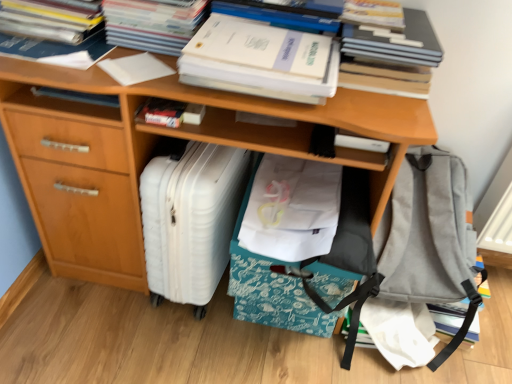
Find the location of a particular element. white matte book at center, the 3th book viewed from the right is located at coordinates (194, 114).

Describe the element at coordinates (428, 239) in the screenshot. The height and width of the screenshot is (384, 512). I see `gray fabric backpack at lower right` at that location.

What do you see at coordinates (57, 50) in the screenshot?
I see `white paper at upper left, which is counted as the first book, starting from the left` at bounding box center [57, 50].

Where is `white matte book at center, the 3th book viewed from the right`? white matte book at center, the 3th book viewed from the right is located at coordinates (194, 114).

Based on the photo, considering the sizes of white paper at upper left, which is counted as the first book, starting from the left, and white matte book at center, the 3th book viewed from the right, in the image, is white paper at upper left, which is counted as the first book, starting from the left, bigger or smaller than white matte book at center, the 3th book viewed from the right,?

Considering their sizes, white paper at upper left, which is counted as the first book, starting from the left, takes up more space than white matte book at center, the 3th book viewed from the right.

From the image's perspective, who appears lower, white paper at upper left, which appears as the sixth book when viewed from the right, or white matte book at center, the 3th book viewed from the right?

white matte book at center, the 3th book viewed from the right, appears lower in the image.

From a real-world perspective, who is located higher, white paper at upper left, which appears as the sixth book when viewed from the right, or white matte book at center, the 3th book viewed from the right?

white paper at upper left, which appears as the sixth book when viewed from the right.

From the image's perspective, which is below, hardcover book at center, positioned as the 3th paperback book in right-to-left order, or white plastic suitcase at lower left?

From the image's view, white plastic suitcase at lower left is below.

Looking at this image, from a real-world perspective, between hardcover book at center, positioned as the 3th paperback book in right-to-left order, and white plastic suitcase at lower left, who is vertically higher?

hardcover book at center, positioned as the 3th paperback book in right-to-left order, from a real-world perspective.

Between hardcover book at center, positioned as the 3th paperback book in right-to-left order, and white plastic suitcase at lower left, which one appears on the left side from the viewer's perspective?

From the viewer's perspective, hardcover book at center, positioned as the 3th paperback book in right-to-left order, appears more on the left side.

Is hardcover book at center, positioned as the 3th paperback book in right-to-left order, far from white plastic suitcase at lower left?

Actually, hardcover book at center, positioned as the 3th paperback book in right-to-left order, and white plastic suitcase at lower left are a little close together.

From a real-world perspective, is white paper at upper left, which is counted as the second book, starting from the left, physically above white paper at upper center, the second paperback book viewed from the left?

Incorrect, from a real-world perspective, white paper at upper left, which is counted as the second book, starting from the left, is lower than white paper at upper center, the second paperback book viewed from the left.

Is the surface of white paper at upper left, which is counted as the second book, starting from the left, in direct contact with white paper at upper center, the second paperback book viewed from the left?

No, white paper at upper left, which is counted as the second book, starting from the left, is not next to white paper at upper center, the second paperback book viewed from the left.

Which of these two, white paper at upper left, which is counted as the second book, starting from the left, or white paper at upper center, the second paperback book viewed from the left, stands shorter?

white paper at upper left, which is counted as the second book, starting from the left, is shorter.

Does point (72, 34) come behind point (108, 0)?

Yes, point (72, 34) is behind point (108, 0).

Is white paper at upper left, which is counted as the first book, starting from the left, not close to gray fabric backpack at lower right?

Yes, white paper at upper left, which is counted as the first book, starting from the left, and gray fabric backpack at lower right are quite far apart.

From a real-world perspective, which is physically above, white paper at upper left, which is counted as the first book, starting from the left, or gray fabric backpack at lower right?

From a 3D spatial view, white paper at upper left, which is counted as the first book, starting from the left, is above.

Is white paper at upper left, which appears as the sixth book when viewed from the right, positioned before gray fabric backpack at lower right?

Yes, white paper at upper left, which appears as the sixth book when viewed from the right, is closer to the viewer.

Considering the sizes of white paper at upper left, which is counted as the first book, starting from the left, and gray fabric backpack at lower right in the image, is white paper at upper left, which is counted as the first book, starting from the left, wider or thinner than gray fabric backpack at lower right?

Considering their sizes, white paper at upper left, which is counted as the first book, starting from the left, looks slimmer than gray fabric backpack at lower right.

The image size is (512, 384). I want to click on luggage that appears below the white fabric at center (from a real-world perspective), so click(191, 220).

Considering the sizes of objects white fabric at center and white plastic suitcase at lower left in the image provided, who is smaller, white fabric at center or white plastic suitcase at lower left?

white fabric at center is smaller.

Consider the image. Considering the sizes of white fabric at center and white plastic suitcase at lower left in the image, is white fabric at center wider or thinner than white plastic suitcase at lower left?

Considering their sizes, white fabric at center looks broader than white plastic suitcase at lower left.

Are white fabric at center and white plastic suitcase at lower left located far from each other?

That's not correct — white fabric at center is a little close to white plastic suitcase at lower left.

Is hardcover book at upper center, which is the 5th book in left-to-right order, facing towards wooden desk at center?

No, hardcover book at upper center, which is the 5th book in left-to-right order, is not aimed at wooden desk at center.

From the image's perspective, is hardcover book at upper center, the 2th book from the right, located beneath wooden desk at center?

No, from the image's perspective, hardcover book at upper center, the 2th book from the right, is not below wooden desk at center.

Based on their sizes in the image, would you say hardcover book at upper center, which is the 5th book in left-to-right order, is bigger or smaller than wooden desk at center?

Considering their sizes, hardcover book at upper center, which is the 5th book in left-to-right order, takes up less space than wooden desk at center.

Considering the positions of point (232, 15) and point (208, 129), is point (232, 15) closer or farther from the camera than point (208, 129)?

Point (232, 15) is positioned farther from the camera compared to point (208, 129).

From a real-world perspective, is white plastic suitcase at lower left located higher than white matte book at center, positioned as the 4th book in left-to-right order?

No.

Could you tell me if white plastic suitcase at lower left is facing white matte book at center, positioned as the 4th book in left-to-right order?

No, white plastic suitcase at lower left does not turn towards white matte book at center, positioned as the 4th book in left-to-right order.

Is white plastic suitcase at lower left smaller than white matte book at center, positioned as the 4th book in left-to-right order?

Incorrect, white plastic suitcase at lower left is not smaller in size than white matte book at center, positioned as the 4th book in left-to-right order.

The image size is (512, 384). I want to click on the 3rd book counting from the left side of the white matte book at center, positioned as the 4th book in left-to-right order, so click(x=57, y=50).

Locate an element on the screen. the 1st paperback book in front when counting from the white plastic suitcase at lower left is located at coordinates (162, 112).

Based on their spatial positions, is hardcover book at center, the first paperback book viewed from the left, or white matte paper at upper center, which appears as the first paperback book when viewed from the right, closer to white paper at upper left, acting as the fifth book starting from the right?

The object closer to white paper at upper left, acting as the fifth book starting from the right, is hardcover book at center, the first paperback book viewed from the left.

Based on their spatial positions, is white paper at upper left, which appears as the sixth book when viewed from the right, or white paper at upper left, acting as the fifth book starting from the right, closer to wooden desk at center?

The object closer to wooden desk at center is white paper at upper left, which appears as the sixth book when viewed from the right.

Based on their spatial positions, is white paper at upper left, which is counted as the 3th book, starting from the left, or white paper at upper left, which is counted as the first book, starting from the left, further from wooden desk at center?

white paper at upper left, which is counted as the first book, starting from the left.

From the image, which object appears to be nearer to white paper at upper left, which appears as the sixth book when viewed from the right, white matte paper at upper center, which appears as the first paperback book when viewed from the right, or white matte book at center, the 3th book viewed from the right?

The object closer to white paper at upper left, which appears as the sixth book when viewed from the right, is white matte book at center, the 3th book viewed from the right.

Considering their positions, is white plastic suitcase at lower left positioned further to hardcover book at upper right, the 1th book when ordered from right to left, than white paper at upper center, positioned as the 2th paperback book in right-to-left order?

The object further to hardcover book at upper right, the 1th book when ordered from right to left, is white plastic suitcase at lower left.

When comparing their distances from white matte paper at upper center, which appears as the first paperback book when viewed from the right, does white matte book at center, positioned as the 4th book in left-to-right order, or wooden desk at center seem closer?

Among the two, white matte book at center, positioned as the 4th book in left-to-right order, is located nearer to white matte paper at upper center, which appears as the first paperback book when viewed from the right.

Based on their spatial positions, is white matte paper at upper center, which appears as the first paperback book when viewed from the right, or hardcover book at center, the first paperback book viewed from the left, closer to gray fabric backpack at lower right?

white matte paper at upper center, which appears as the first paperback book when viewed from the right, lies closer to gray fabric backpack at lower right than the other object.

When comparing their distances from white paper at upper center, the second paperback book viewed from the left, does white plastic suitcase at lower left or hardcover book at upper right, which is the sixth book in left-to-right order, seem closer?

white plastic suitcase at lower left lies closer to white paper at upper center, the second paperback book viewed from the left, than the other object.

Identify the location of paperback book situated between wooden desk at center and hardcover book at upper right, which is the sixth book in left-to-right order, from left to right. This screenshot has width=512, height=384. point(261,46).

The image size is (512, 384). I want to click on paperback book between white paper at upper left, which appears as the sixth book when viewed from the right, and white paper at upper center, positioned as the 2th paperback book in right-to-left order, from left to right, so click(162, 112).

At what (x,y) coordinates should I click in order to perform the action: click on paperback book located between white plastic suitcase at lower left and gray fabric backpack at lower right in the left-right direction. Please return your answer as a coordinate pair (x, y). Looking at the image, I should click on (261, 46).

This screenshot has width=512, height=384. Find the location of `desk that lies between white paper at upper left, which appears as the 4th book when viewed from the right, and white plastic suitcase at lower left from top to bottom`. desk that lies between white paper at upper left, which appears as the 4th book when viewed from the right, and white plastic suitcase at lower left from top to bottom is located at coordinates (176, 137).